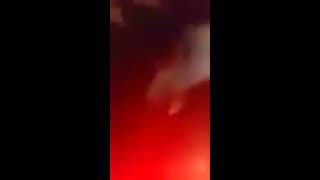
Find the location of a particular element. This screenshot has height=180, width=320. light source is located at coordinates (208, 176).